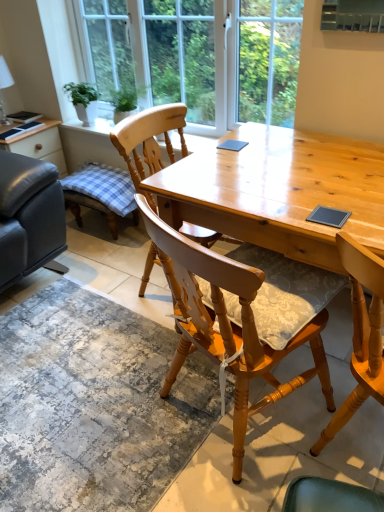
Locate an element on the screen. This screenshot has width=384, height=512. empty space that is ontop of textured gray rug at lower center (from a real-world perspective) is located at coordinates (74, 397).